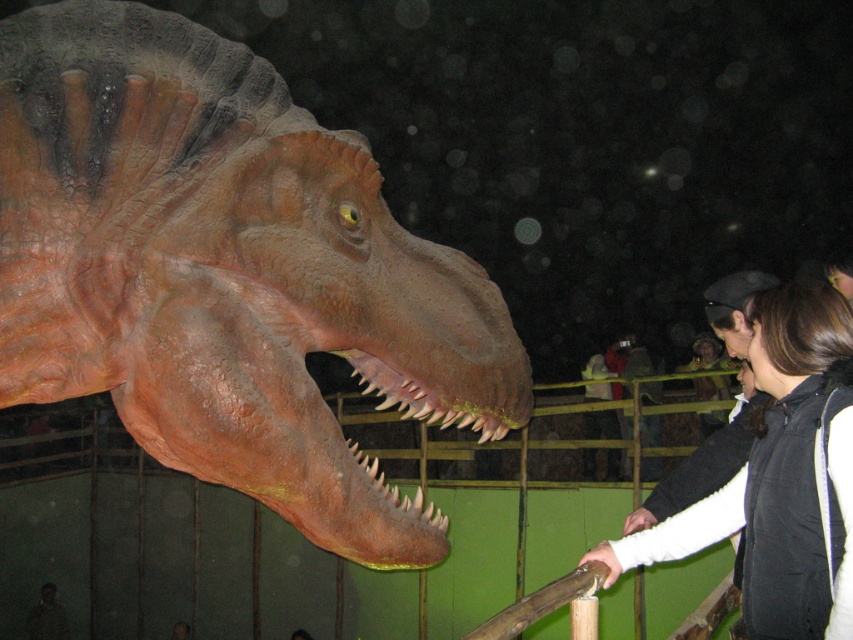
Question: Which object is farther from the camera taking this photo?

Choices:
 (A) matte orange dinosaur head at center
 (B) dark brown hair at upper right

Answer: (B)

Question: Does matte orange dinosaur head at center come behind dark brown hair at upper right?

Choices:
 (A) yes
 (B) no

Answer: (B)

Question: Which point is farther to the camera?

Choices:
 (A) matte orange dinosaur head at center
 (B) dark brown hair at upper right

Answer: (B)

Question: Can you confirm if matte orange dinosaur head at center is positioned above dark brown hair at upper right?

Choices:
 (A) yes
 (B) no

Answer: (A)

Question: Can you confirm if matte orange dinosaur head at center is wider than dark brown hair at upper right?

Choices:
 (A) yes
 (B) no

Answer: (A)